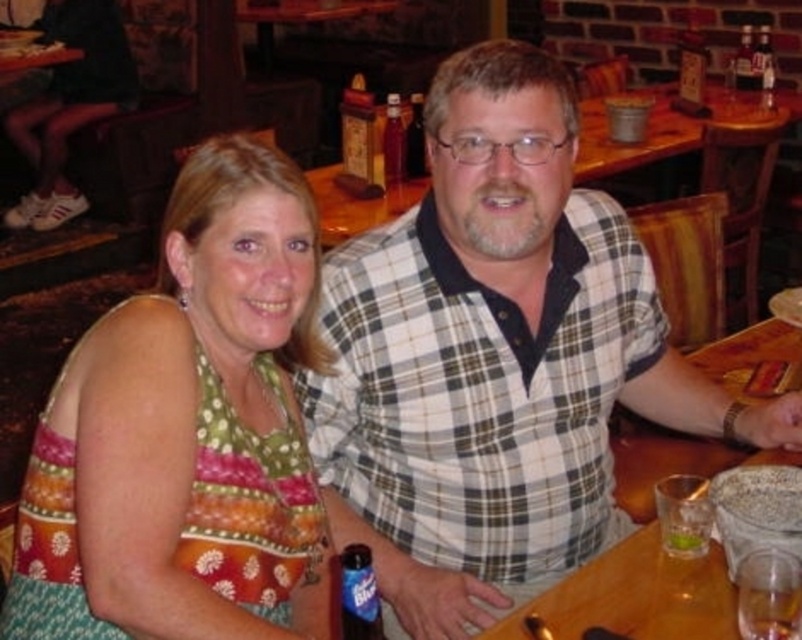
You are a photographer standing at the entrance of the dining area. You want to take a photo of the multicolored fabric dress at center without moving any objects. Can you position yourself so that the dress is centered in your viewfinder while avoiding the glass and bottle of beer?

The multicolored fabric dress at center is located at point (184,426), so you can position yourself to center it in the viewfinder while avoiding the glass and bottle of beer by adjusting your angle or distance appropriately.

You are a waiter in a restaurant. You see a white checkered shirt at center and a blue plastic bottle at lower center. Which item is closer to the right edge of the table?

The white checkered shirt at center is positioned on the right side of blue plastic bottle at lower center, so the white checkered shirt at center is closer to the right edge of the table.